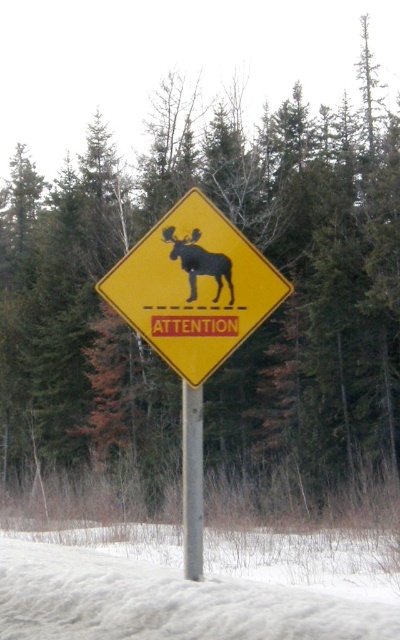
Looking at this image, you are driving a car and see the metallic gray pole at center and the black matte moose at center on a road sign. Which object is positioned lower in the image?

The metallic gray pole at center is positioned below the black matte moose at center, so the metallic gray pole at center is lower in the image.

You are standing at the center of the image and want to place a new sign exactly where the metallic gray pole at center is currently located. According to the coordinates provided, what are the exact coordinates where you should place the new sign?

The metallic gray pole at center is located at point (192,480), so you should place the new sign at those exact coordinates.

You are driving a car and need to know if the yellow plastic diamond at center is wider than the metallic gray pole at center. Based on the scene, can you determine which one is wider?

The yellow plastic diamond at center is wider than the metallic gray pole at center according to the description.